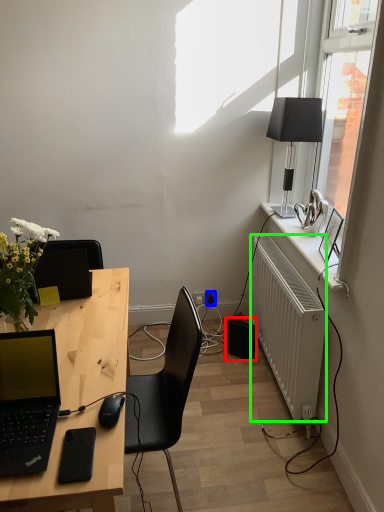
Question: Estimate the real-world distances between objects in this image. Which object is closer to speaker (highlighted by a red box), power outlet (highlighted by a blue box) or radiator (highlighted by a green box)?

Choices:
 (A) power outlet
 (B) radiator

Answer: (A)